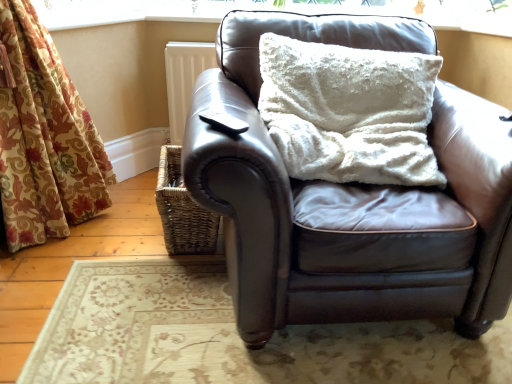
Question: Is matte brown leather couch at center to the right of woven brown basket at lower left from the viewer's perspective?

Choices:
 (A) no
 (B) yes

Answer: (B)

Question: Can you confirm if matte brown leather couch at center is positioned to the left of woven brown basket at lower left?

Choices:
 (A) yes
 (B) no

Answer: (B)

Question: Considering the relative sizes of matte brown leather couch at center and woven brown basket at lower left in the image provided, is matte brown leather couch at center bigger than woven brown basket at lower left?

Choices:
 (A) no
 (B) yes

Answer: (B)

Question: Considering the relative sizes of matte brown leather couch at center and woven brown basket at lower left in the image provided, is matte brown leather couch at center taller than woven brown basket at lower left?

Choices:
 (A) no
 (B) yes

Answer: (B)

Question: From the image's perspective, would you say matte brown leather couch at center is positioned over woven brown basket at lower left?

Choices:
 (A) yes
 (B) no

Answer: (A)

Question: From a real-world perspective, is woven brown basket at lower left positioned above or below white fluffy pillow at upper center?

Choices:
 (A) above
 (B) below

Answer: (B)

Question: From their relative heights in the image, would you say woven brown basket at lower left is taller or shorter than white fluffy pillow at upper center?

Choices:
 (A) short
 (B) tall

Answer: (A)

Question: From the image's perspective, is woven brown basket at lower left above or below white fluffy pillow at upper center?

Choices:
 (A) below
 (B) above

Answer: (A)

Question: Relative to white fluffy pillow at upper center, is woven brown basket at lower left in front or behind?

Choices:
 (A) behind
 (B) front

Answer: (A)

Question: Based on their sizes in the image, would you say white textured cushion at upper center is bigger or smaller than matte brown leather couch at center?

Choices:
 (A) small
 (B) big

Answer: (A)

Question: From their relative heights in the image, would you say white textured cushion at upper center is taller or shorter than matte brown leather couch at center?

Choices:
 (A) tall
 (B) short

Answer: (B)

Question: Visually, is white textured cushion at upper center positioned to the left or to the right of matte brown leather couch at center?

Choices:
 (A) right
 (B) left

Answer: (B)

Question: From the image's perspective, is white textured cushion at upper center above or below matte brown leather couch at center?

Choices:
 (A) above
 (B) below

Answer: (A)

Question: From their relative heights in the image, would you say white fluffy pillow at upper center is taller or shorter than woven brown basket at lower left?

Choices:
 (A) tall
 (B) short

Answer: (A)

Question: Is point (373, 117) closer or farther from the camera than point (188, 228)?

Choices:
 (A) farther
 (B) closer

Answer: (B)